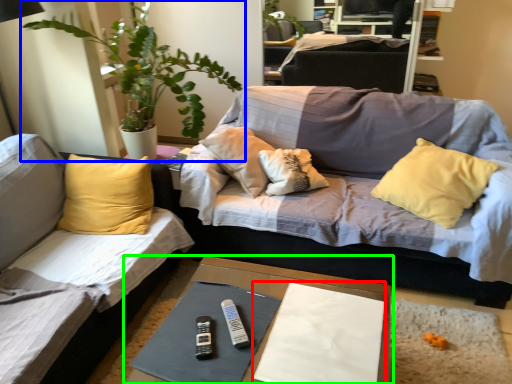
Question: Based on their relative distances, which object is farther from sheet (highlighted by a red box)? Choose from houseplant (highlighted by a blue box) and table (highlighted by a green box).

Choices:
 (A) houseplant
 (B) table

Answer: (A)